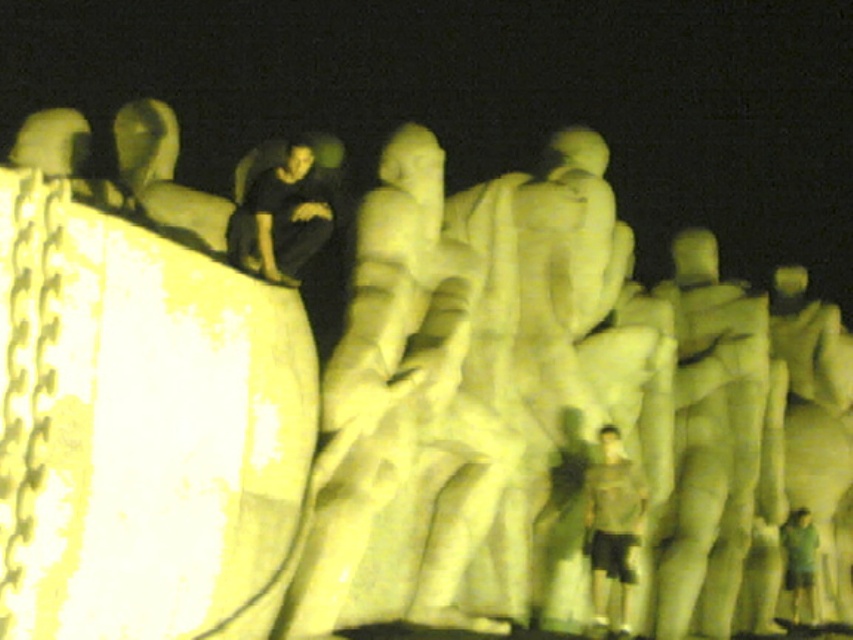
Question: Does dark fabric pants at upper left have a lesser width compared to green fabric shirt at lower right?

Choices:
 (A) no
 (B) yes

Answer: (A)

Question: Is dark fabric pants at upper left below green fabric shirt at lower right?

Choices:
 (A) yes
 (B) no

Answer: (B)

Question: Which object is the closest to the green fabric shirt at lower right?

Choices:
 (A) light brown fabric shirt at center
 (B) dark fabric pants at upper left

Answer: (A)

Question: Is light brown fabric shirt at center above green fabric shirt at lower right?

Choices:
 (A) no
 (B) yes

Answer: (B)

Question: Among these objects, which one is farthest from the camera?

Choices:
 (A) green fabric shirt at lower right
 (B) light brown fabric shirt at center
 (C) dark fabric pants at upper left

Answer: (A)

Question: Which object is closer to the camera taking this photo?

Choices:
 (A) green fabric shirt at lower right
 (B) dark fabric pants at upper left
 (C) light brown fabric shirt at center

Answer: (B)